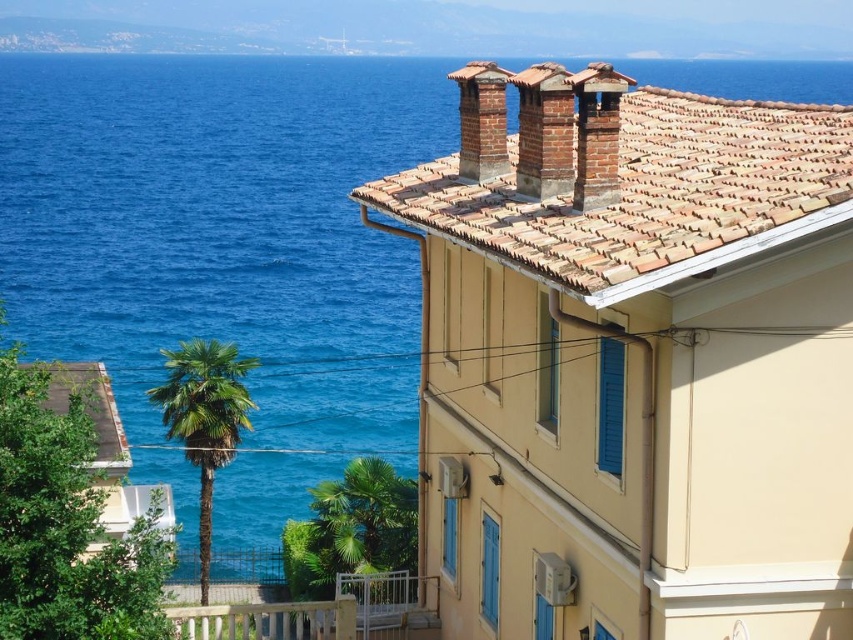
You are standing at the edge of the beach looking at the white painted wood at lower center and the green leafy palm tree at center. Which object is wider from your viewpoint?

The white painted wood at lower center might be wider than the green leafy palm tree at center according to the description.

You are standing in front of the beige building with blue shutters and want to walk towards the ocean. There is white painted wood at lower center and a green leafy palm tree at center in your path. Which object should you avoid stepping on to stay on the correct path towards the ocean?

You should avoid stepping on the white painted wood at lower center because it is positioned on the right side of the green leafy palm tree at center, which is likely part of the path leading towards the ocean.

You are standing at the center of the image and want to walk towards the green leafy palm tree at center. Which direction should you move relative to your current position?

Since the green leafy palm tree at center is located at point [360,524], you should move towards the right and slightly upwards from your current position at the center.